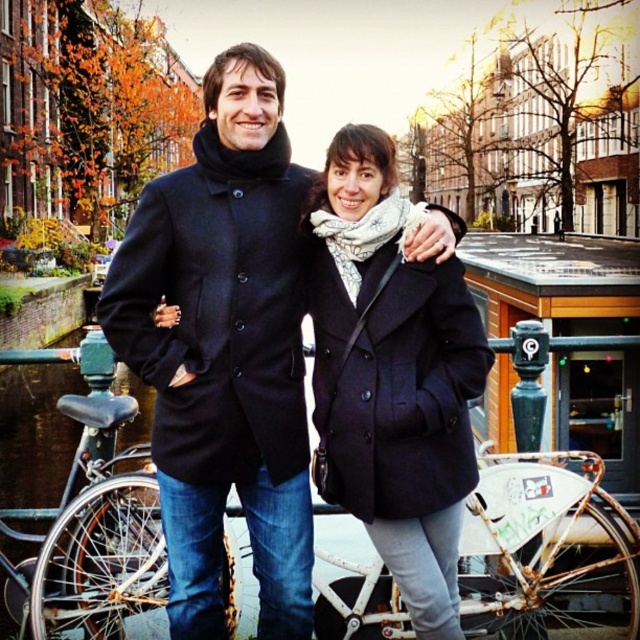
You are a tailor measuring coats for alterations. You have two coats in front of you, the black wool coat at center and the matte black coat at center. Which coat requires a wider alteration table?

The black wool coat at center requires a wider alteration table because its width surpasses that of the matte black coat at center.